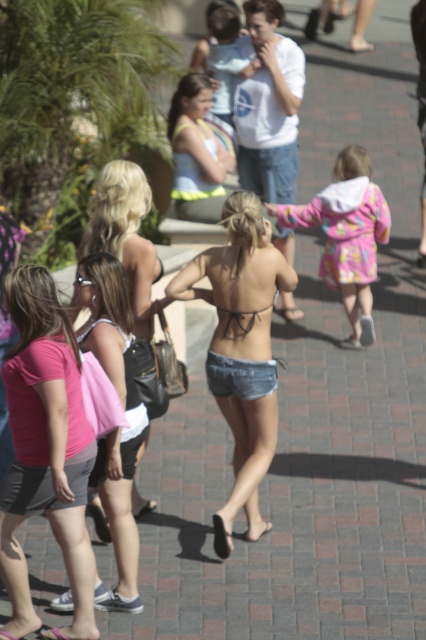
Question: From the image, what is the correct spatial relationship of pink fabric shorts at lower left in relation to pink fabric dress at lower left?

Choices:
 (A) below
 (B) above

Answer: (A)

Question: Which of these objects is positioned farthest from the pink fabric dress at lower left?

Choices:
 (A) pink fabric shorts at lower left
 (B) denim shorts at center
 (C) matte yellow bikini top at center

Answer: (C)

Question: In this image, where is pink fabric shorts at lower left located relative to matte black bikini top at center?

Choices:
 (A) below
 (B) above

Answer: (A)

Question: Among these points, which one is nearest to the camera?

Choices:
 (A) (81, 304)
 (B) (68, 360)

Answer: (B)

Question: Estimate the real-world distances between objects in this image. Which object is closer to the pink fabric dress at lower left?

Choices:
 (A) denim shorts at center
 (B) pink fabric shorts at lower left

Answer: (B)

Question: Can you confirm if fluffy pink coat at center is wider than matte yellow bikini top at center?

Choices:
 (A) yes
 (B) no

Answer: (A)